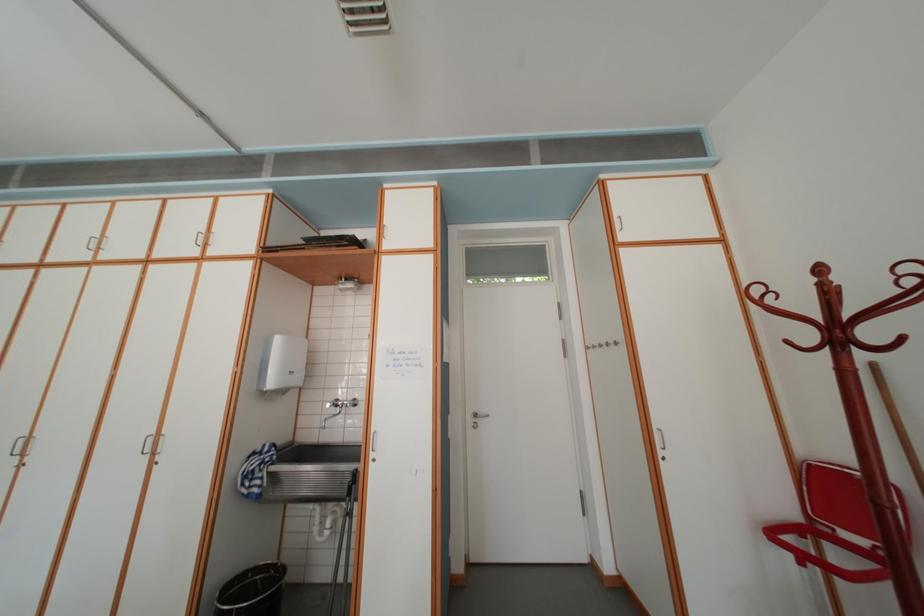
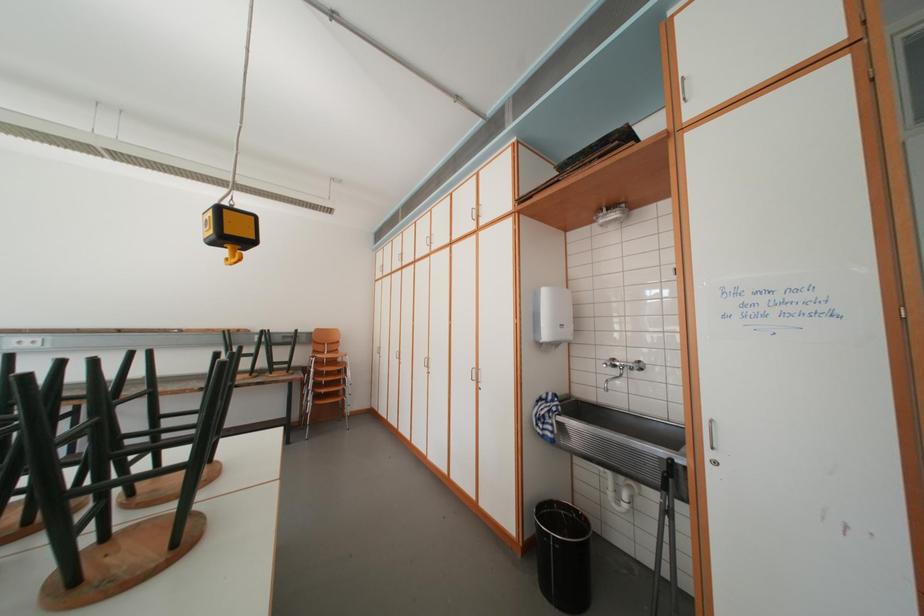
Question: The first image is from the beginning of the video and the second image is from the end. How did the camera likely rotate when shooting the video?

Choices:
 (A) Left
 (B) Right
 (C) Up
 (D) Down

Answer: (A)